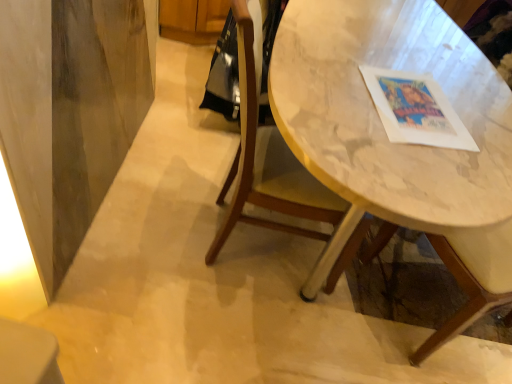
At what (x,y) coordinates should I click in order to perform the action: click on free spot above marble table at center (from a real-world perspective). Please return your answer as a coordinate pair (x, y). The image size is (512, 384). Looking at the image, I should click on (394, 52).